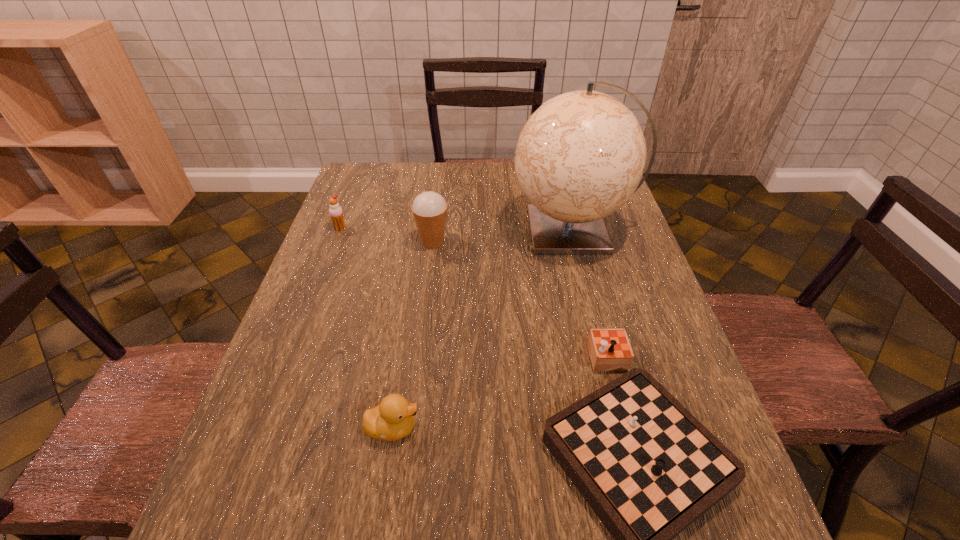
This screenshot has height=540, width=960. What are the coordinates of `blank space located at the front with a straw on the third tallest object` in the screenshot? It's located at (329, 256).

This screenshot has height=540, width=960. I want to click on free space located facing forward on the duckling, so pos(631,428).

Where is `object that is at the far edge`? This screenshot has width=960, height=540. object that is at the far edge is located at coordinates (580, 156).

Where is `object situated at the left edge`? object situated at the left edge is located at coordinates (336, 213).

This screenshot has width=960, height=540. I want to click on object situated at the right edge, so click(x=580, y=156).

This screenshot has width=960, height=540. In order to click on object that is at the far right corner in this screenshot , I will do `click(580, 156)`.

The image size is (960, 540). In the image, there is a desktop. Identify the location of vacant space at the far edge. (492, 179).

Locate an element on the screen. The width and height of the screenshot is (960, 540). vacant area at the left edge is located at coordinates (325, 262).

Identify the location of free space at the right edge. (689, 371).

I want to click on free space at the near left corner of the desktop, so click(258, 534).